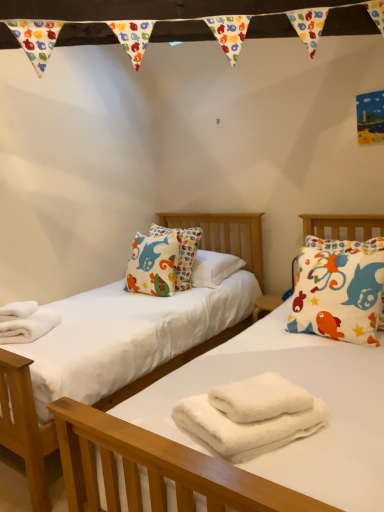
Question: Is white fluffy bath towel at center, the first bath towel when ordered from top to bottom, shorter than white fluffy towels at center, the second bath towel when ordered from top to bottom?

Choices:
 (A) yes
 (B) no

Answer: (A)

Question: Does white fluffy bath towel at center, the first bath towel when ordered from top to bottom, have a greater width compared to white fluffy towels at center, which is the 1th bath towel in bottom-to-top order?

Choices:
 (A) no
 (B) yes

Answer: (A)

Question: Is white fluffy towels at center, which is the 1th bath towel in bottom-to-top order, inside white fluffy bath towel at center, marked as the second bath towel in a bottom-to-top arrangement?

Choices:
 (A) yes
 (B) no

Answer: (B)

Question: Are white fluffy bath towel at center, marked as the second bath towel in a bottom-to-top arrangement, and white fluffy towels at center, which is the 1th bath towel in bottom-to-top order, making contact?

Choices:
 (A) yes
 (B) no

Answer: (A)

Question: Is white fluffy bath towel at center, marked as the second bath towel in a bottom-to-top arrangement, at the left side of white fluffy towels at center, the second bath towel when ordered from top to bottom?

Choices:
 (A) yes
 (B) no

Answer: (B)

Question: Is white fluffy towels at center, the second bath towel when ordered from top to bottom, taller or shorter than white cotton pillow with colorful fish at right?

Choices:
 (A) tall
 (B) short

Answer: (B)

Question: Looking at the image, does white fluffy towels at center, which is the 1th bath towel in bottom-to-top order, seem bigger or smaller compared to white cotton pillow with colorful fish at right?

Choices:
 (A) small
 (B) big

Answer: (A)

Question: From a real-world perspective, is white fluffy towels at center, the second bath towel when ordered from top to bottom, physically located above or below white cotton pillow with colorful fish at right?

Choices:
 (A) above
 (B) below

Answer: (B)

Question: In terms of width, does white fluffy towels at center, which is the 1th bath towel in bottom-to-top order, look wider or thinner when compared to white cotton pillow with colorful fish at right?

Choices:
 (A) wide
 (B) thin

Answer: (A)

Question: In terms of height, does white fluffy bath towel at center, the first bath towel when ordered from top to bottom, look taller or shorter compared to white fluffy towels at lower left?

Choices:
 (A) tall
 (B) short

Answer: (B)

Question: Is white fluffy bath towel at center, the first bath towel when ordered from top to bottom, spatially inside white fluffy towels at lower left, or outside of it?

Choices:
 (A) outside
 (B) inside

Answer: (A)

Question: From a real-world perspective, is white fluffy bath towel at center, marked as the second bath towel in a bottom-to-top arrangement, above or below white fluffy towels at lower left?

Choices:
 (A) below
 (B) above

Answer: (B)

Question: Does point (231, 388) appear closer or farther from the camera than point (26, 332)?

Choices:
 (A) farther
 (B) closer

Answer: (B)

Question: Considering the positions of point (6, 315) and point (286, 421), is point (6, 315) closer or farther from the camera than point (286, 421)?

Choices:
 (A) farther
 (B) closer

Answer: (A)

Question: From the image's perspective, is white fluffy towels at lower left positioned above or below white fluffy towels at center, which is the 1th bath towel in bottom-to-top order?

Choices:
 (A) above
 (B) below

Answer: (A)